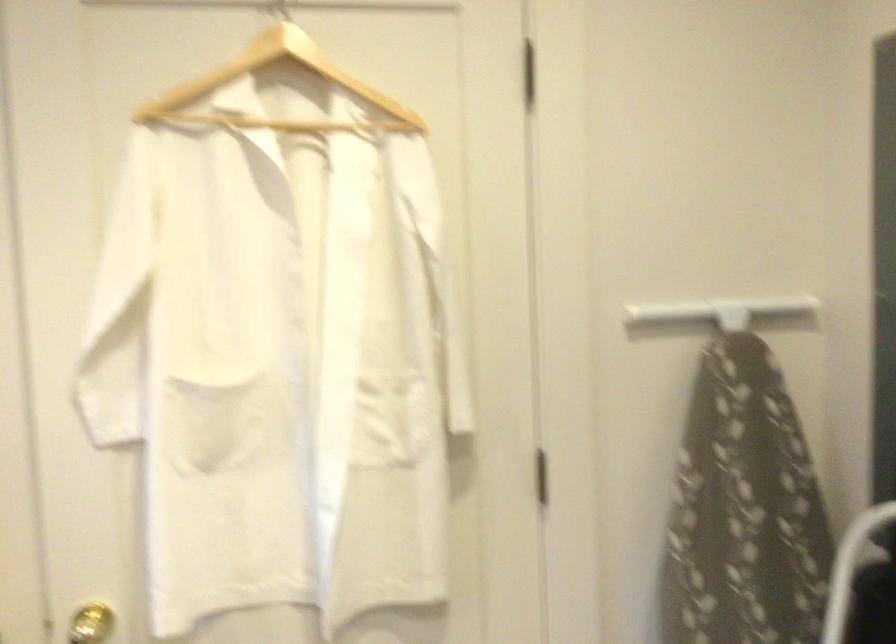
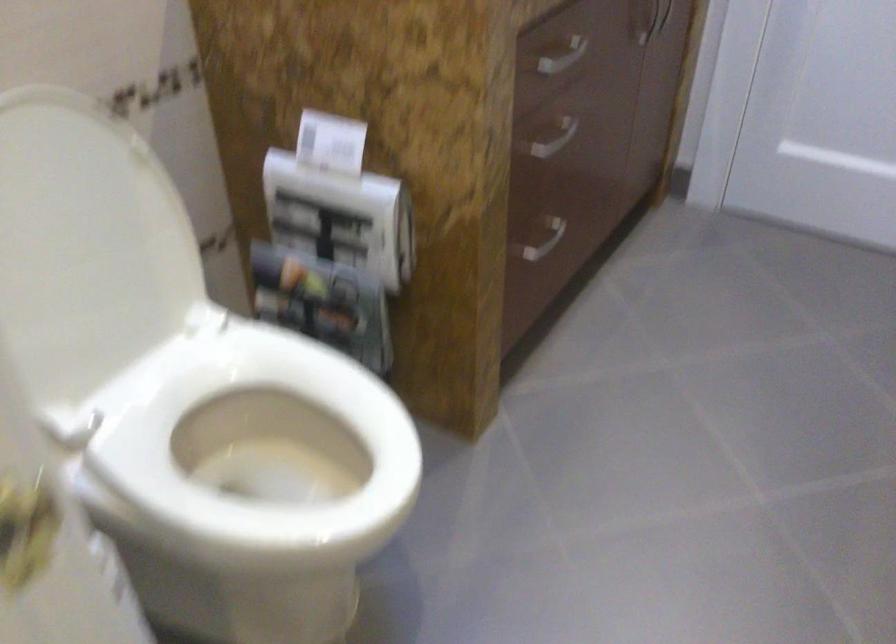
First-person continuous shooting, in which direction is the camera rotating?

The camera's rotation is toward right-down.